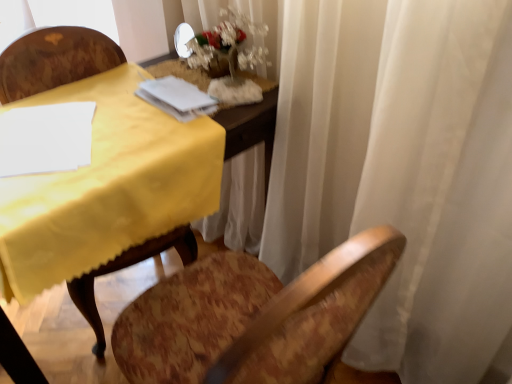
Question: Is wooden chair at left in front of white paper at upper center?

Choices:
 (A) yes
 (B) no

Answer: (A)

Question: From a real-world perspective, is wooden chair at left located higher than white paper at upper center?

Choices:
 (A) yes
 (B) no

Answer: (B)

Question: Considering the relative positions of wooden chair at left and white paper at upper center in the image provided, is wooden chair at left to the left of white paper at upper center from the viewer's perspective?

Choices:
 (A) yes
 (B) no

Answer: (A)

Question: Can you confirm if wooden chair at left is positioned to the right of white paper at upper center?

Choices:
 (A) yes
 (B) no

Answer: (B)

Question: From the image's perspective, is wooden chair at left above white paper at upper center?

Choices:
 (A) no
 (B) yes

Answer: (A)

Question: Would you say wooden chair at left is outside white paper at upper center?

Choices:
 (A) no
 (B) yes

Answer: (B)

Question: Is white frosted glass vase at upper center thinner than wooden chair at left?

Choices:
 (A) yes
 (B) no

Answer: (A)

Question: Is white frosted glass vase at upper center surrounding wooden chair at left?

Choices:
 (A) yes
 (B) no

Answer: (B)

Question: Considering the relative sizes of white frosted glass vase at upper center and wooden chair at left in the image provided, is white frosted glass vase at upper center shorter than wooden chair at left?

Choices:
 (A) yes
 (B) no

Answer: (A)

Question: Is white frosted glass vase at upper center outside of wooden chair at left?

Choices:
 (A) no
 (B) yes

Answer: (B)

Question: Considering the relative sizes of white frosted glass vase at upper center and wooden chair at left in the image provided, is white frosted glass vase at upper center smaller than wooden chair at left?

Choices:
 (A) yes
 (B) no

Answer: (A)

Question: Can you confirm if white frosted glass vase at upper center is bigger than wooden chair at left?

Choices:
 (A) yes
 (B) no

Answer: (B)

Question: Can we say white frosted glass vase at upper center lies outside white paper at upper center?

Choices:
 (A) yes
 (B) no

Answer: (A)